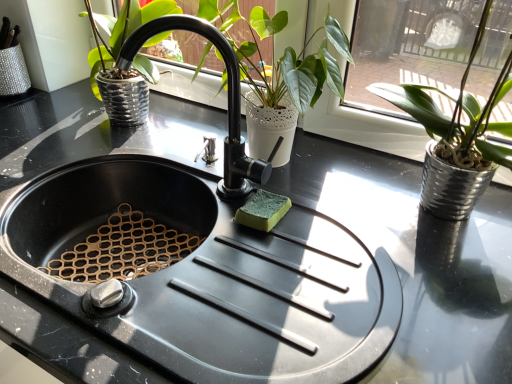
What are the coordinates of `free location to the right of black matte faucet at center` in the screenshot? It's located at (308, 241).